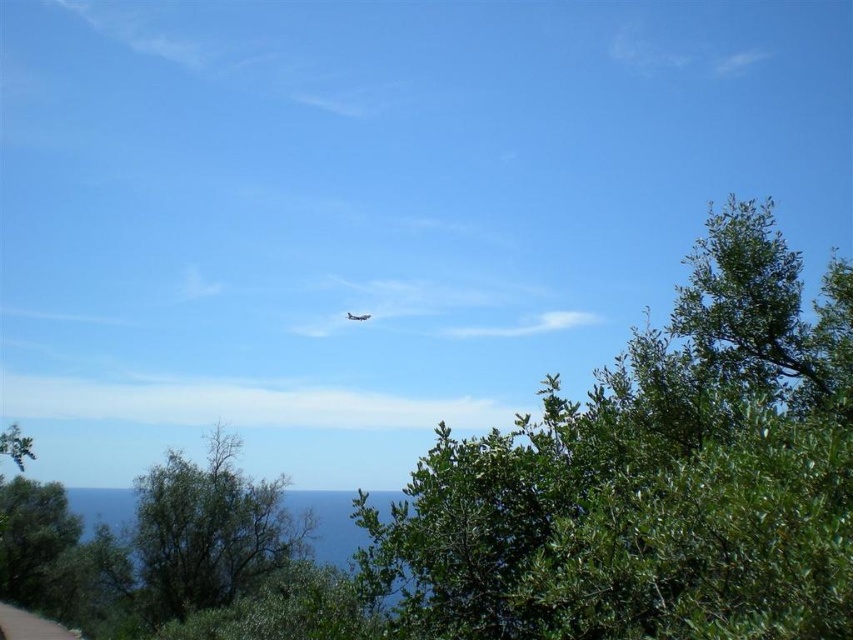
Question: Which point is farther to the camera?

Choices:
 (A) metallic silver airplane at center
 (B) green leafy tree at lower left

Answer: (A)

Question: Which object is closer to the camera taking this photo?

Choices:
 (A) green leafy tree at lower left
 (B) brown dirt path at lower left
 (C) green leafy tree at upper center

Answer: (C)

Question: Can you confirm if green leafy tree at lower left is bigger than metallic silver airplane at center?

Choices:
 (A) yes
 (B) no

Answer: (B)

Question: Observing the image, what is the correct spatial positioning of brown dirt path at lower left in reference to metallic silver airplane at center?

Choices:
 (A) above
 (B) below

Answer: (B)

Question: Considering the real-world distances, which object is closest to the green leafy tree at upper center?

Choices:
 (A) brown dirt path at lower left
 (B) green leafy tree at lower left

Answer: (B)

Question: Does green leafy tree at lower left have a smaller size compared to metallic silver airplane at center?

Choices:
 (A) yes
 (B) no

Answer: (A)